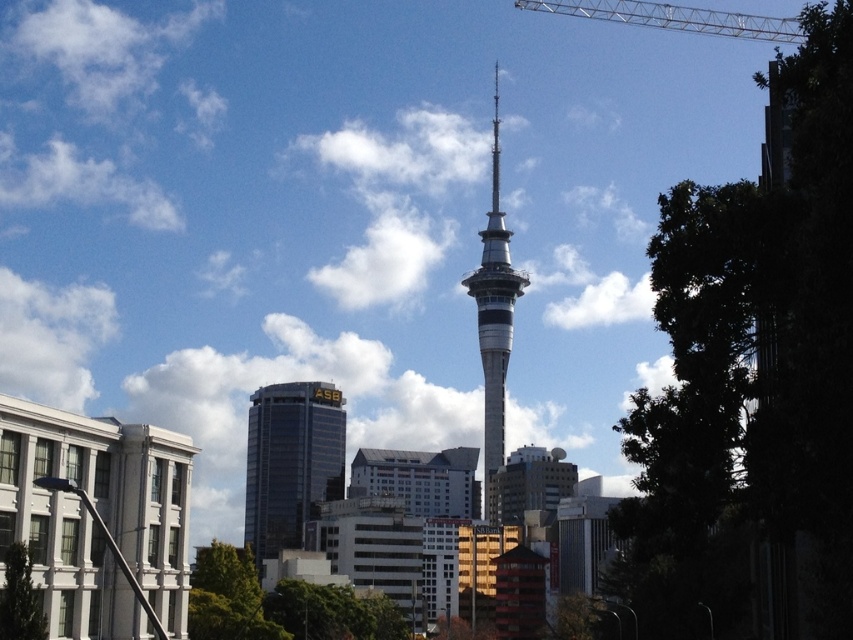
You are a tourist standing in the city and see the shiny glass skyscraper at center and the silver metallic tower at center. Which one is positioned higher up in the image?

The silver metallic tower at center is positioned higher up in the image because the shiny glass skyscraper at center is located below it.

You are a construction worker planning to lower a heavy beam from the silver metallic crane at upper right to the silver metallic tower at center. Is the crane positioned in a way that allows it to safely lower the beam onto the tower?

The silver metallic tower at center is positioned under silver metallic crane at upper right, so the crane is directly above the tower, making it possible to safely lower the beam onto the tower.